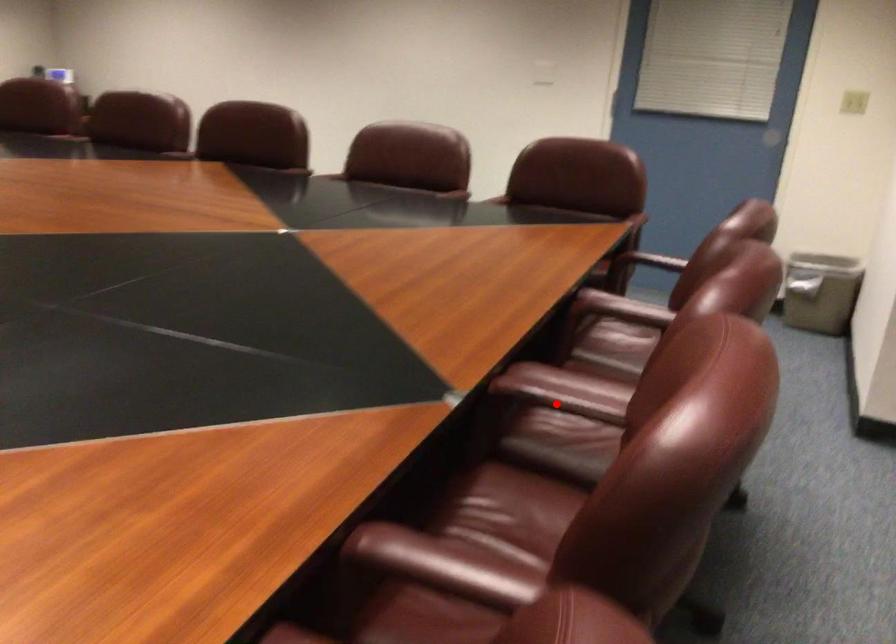
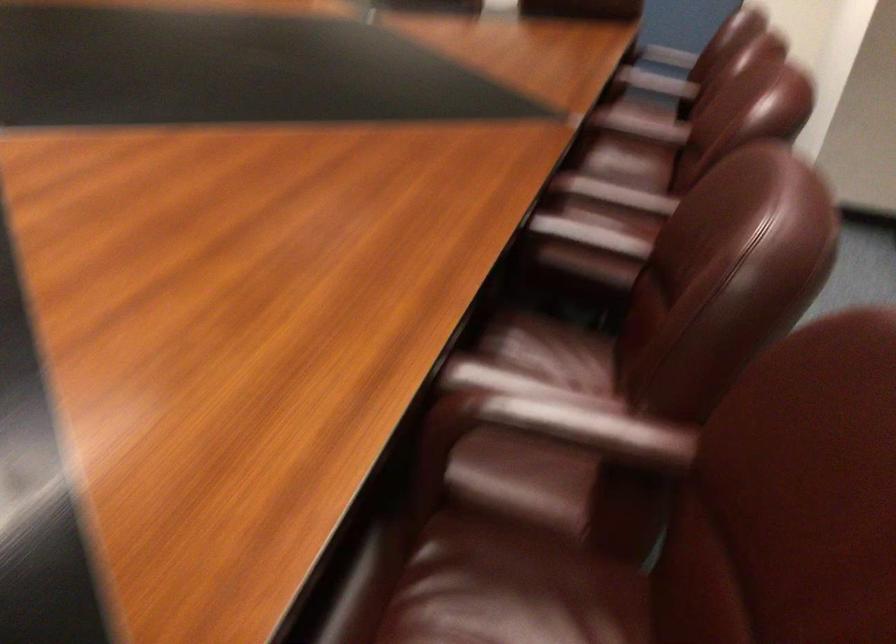
In the second image, find the point that corresponds to the highlighted location in the first image.

(640, 126)